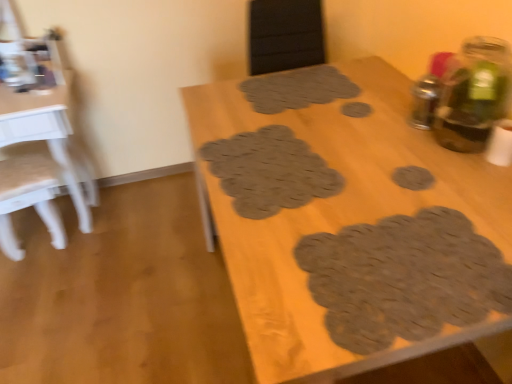
This screenshot has width=512, height=384. Find the location of `vacant space behind brown textured coaster at center-right, the third footprint positioned from the front`. vacant space behind brown textured coaster at center-right, the third footprint positioned from the front is located at coordinates (393, 150).